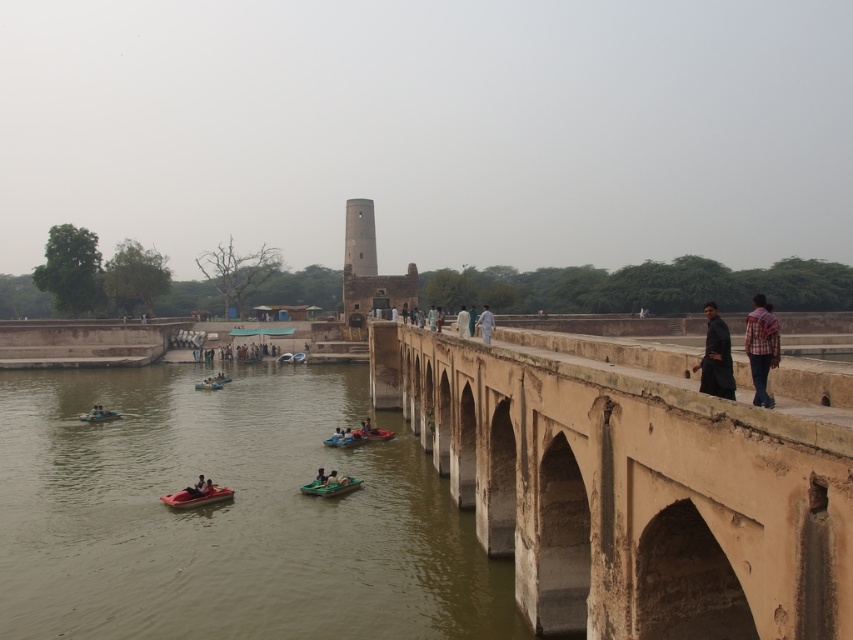
Question: Is brown stone river at lower left wider than dark green fabric boat at lower center?

Choices:
 (A) yes
 (B) no

Answer: (A)

Question: Which object appears closest to the camera in this image?

Choices:
 (A) dark blue fabric boat at lower left
 (B) plaid shirt at right
 (C) dark green fabric boat at lower center
 (D) brown stone river at lower left

Answer: (B)

Question: Based on their relative distances, which object is nearer to the brown stone tower at center?

Choices:
 (A) light brown wooden boat at center
 (B) beige stone bridge at center
 (C) green plastic boat at center

Answer: (B)

Question: Does white cotton dress at center appear on the right side of green plastic boat at lower center?

Choices:
 (A) no
 (B) yes

Answer: (B)

Question: Does brown stone tower at center have a smaller size compared to light beige stone person at center?

Choices:
 (A) no
 (B) yes

Answer: (A)

Question: Which point is farther to the camera?

Choices:
 (A) (329, 436)
 (B) (364, 428)
 (C) (337, 481)
 (D) (357, 321)

Answer: (D)